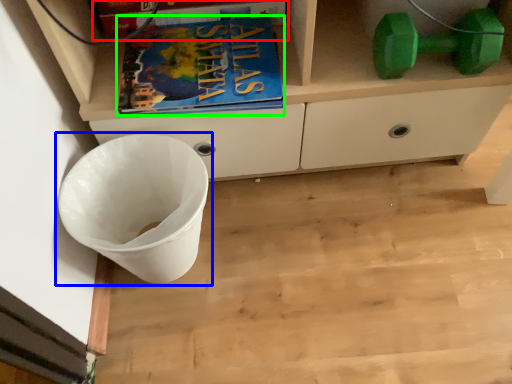
Question: Which object is positioned closest to paperback book (highlighted by a red box)? Select from waste container (highlighted by a blue box) and book (highlighted by a green box).

Choices:
 (A) waste container
 (B) book

Answer: (B)